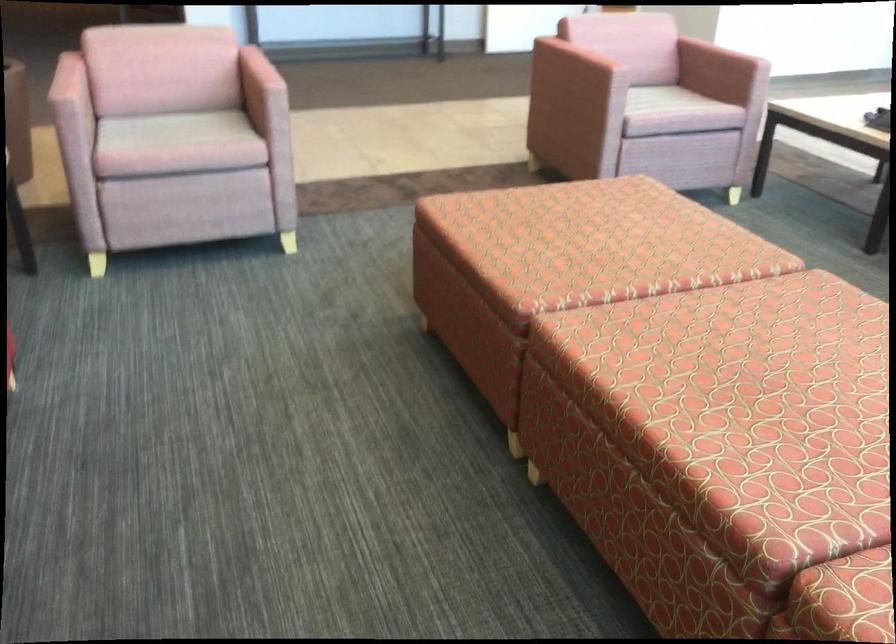
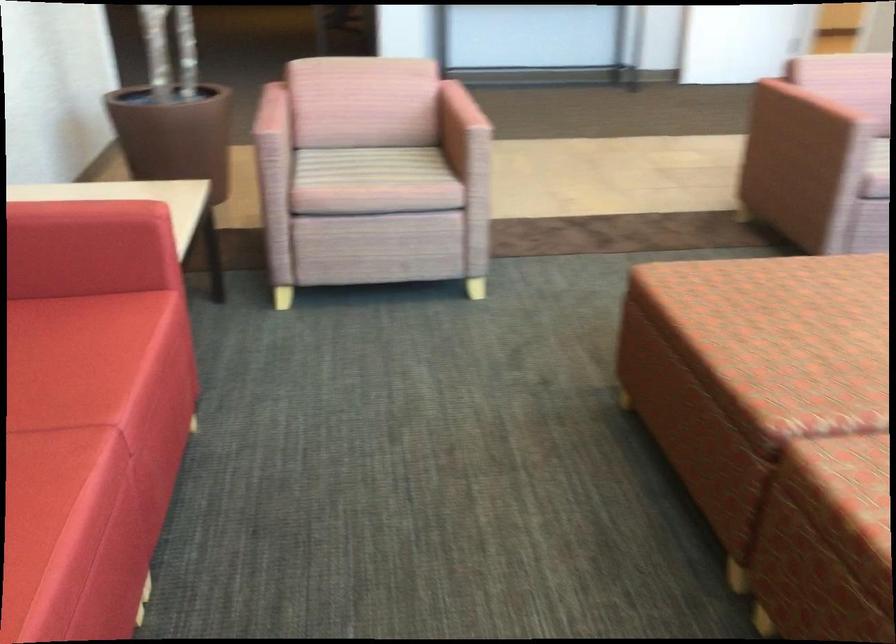
Locate, in the second image, the point that corresponds to (253,79) in the first image.

(459, 118)